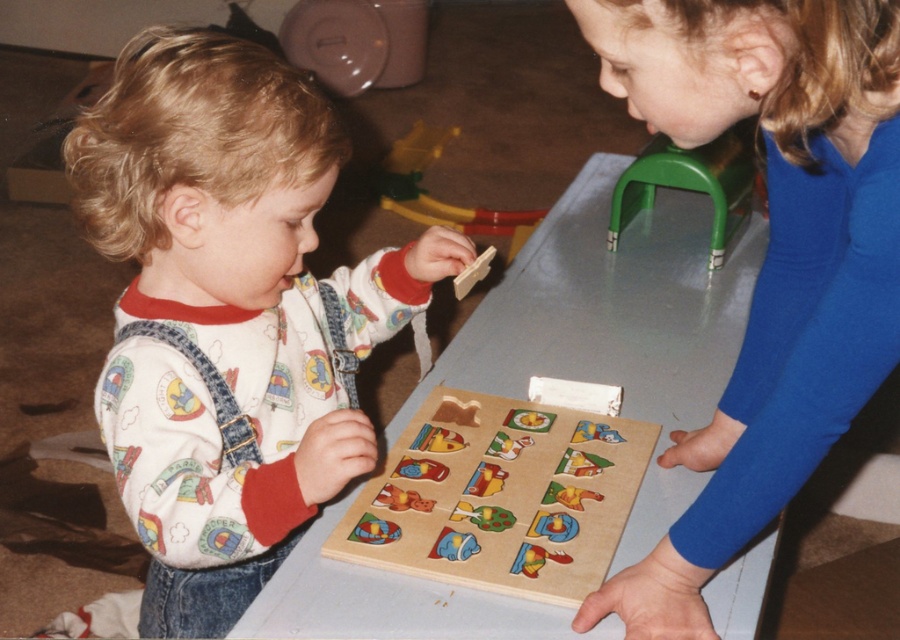
You are a parent trying to hand a toy to both children. The toy is placed on the table between them. If the toy is 12 inches wide, will it fit between the white cotton shirt at center and the blue smooth shirt at upper right?

The white cotton shirt at center and blue smooth shirt at upper right are 16.87 inches apart, so the 12 inch wide toy will fit between them since 12 is less than 16.87.